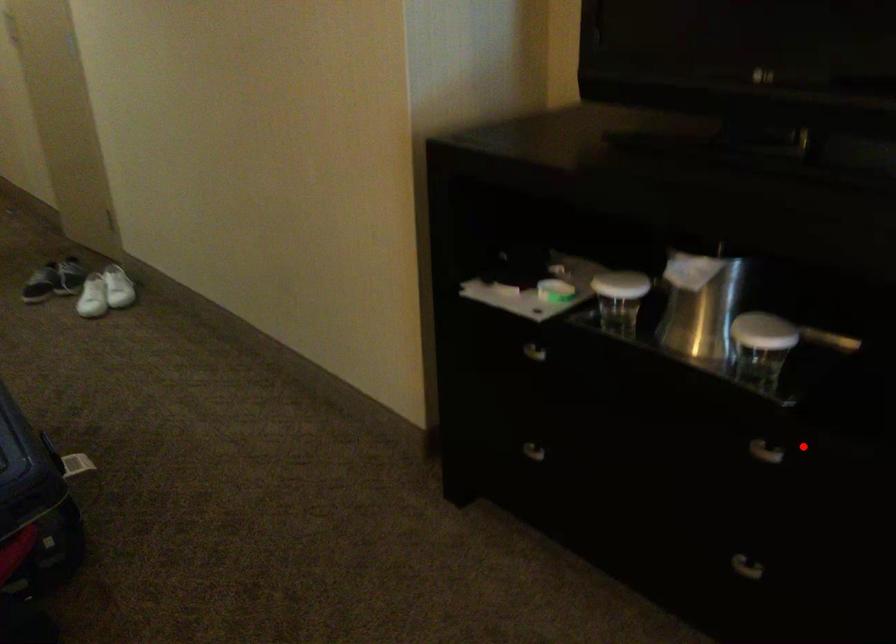
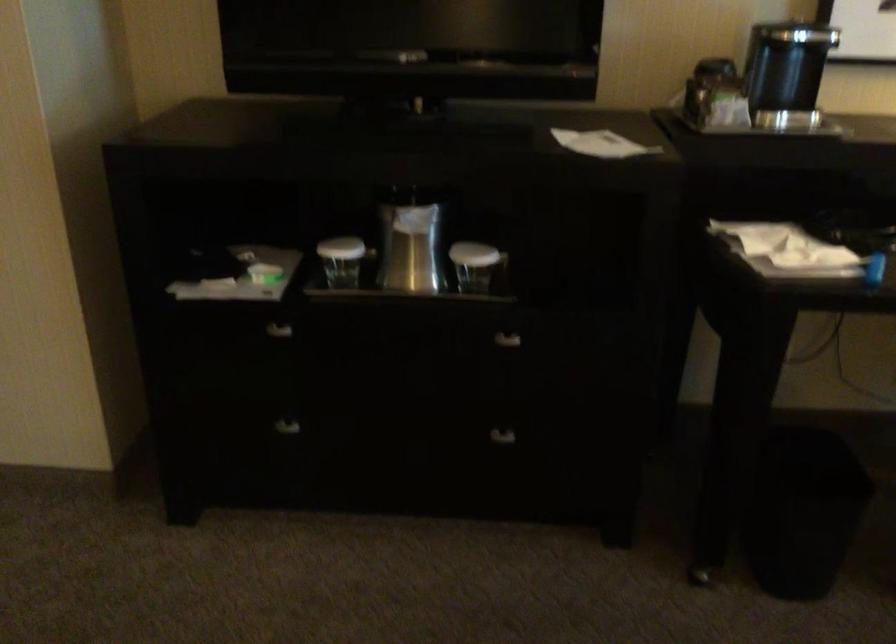
Find the pixel in the second image that matches the highlighted location in the first image.

(515, 337)